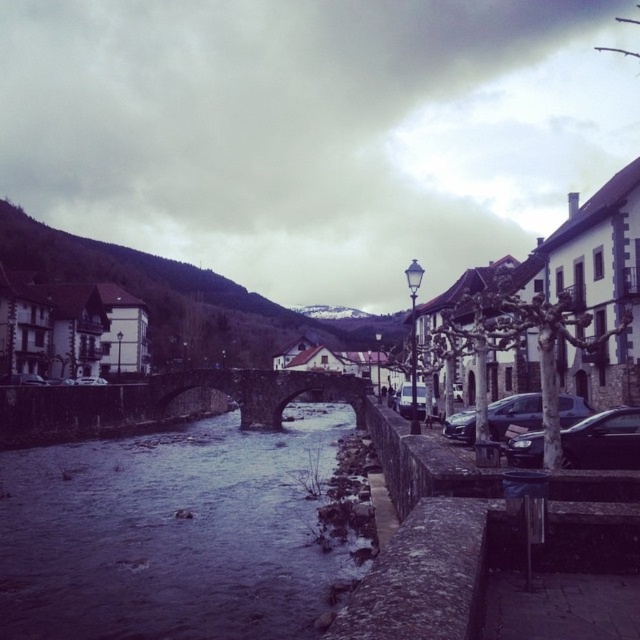
You are a tour guide leading a group along the riverside path. You want to point out both the matte white building at left and the shiny black sedan at center right to your group. If your voice can carry up to 500 feet, can you clearly address both landmarks from your current position without moving?

The matte white building at left and the shiny black sedan at center right are 464.17 feet apart. Since your voice can carry up to 500 feet, you can clearly address both landmarks from your current position without moving.

You are a tourist standing on the riverside path and want to take a photo of the matte white building at left and the shiny black sedan at center right. Based on their positions, which object should you focus on first to ensure both are in the frame?

The matte white building at left is located above the shiny black sedan at center right, so you should focus on the shiny black sedan at center right first to ensure both are in the frame.

You are standing at the riverside and want to take a photo of the dark gray stone river at center without the shiny black sedan at center right blocking the view. Which direction should you move to ensure the sedan is out of frame?

Move to the left of the dark gray stone river at center. Since the dark gray stone river at center is positioned under the shiny black sedan at center right, moving left would place the sedan out of the frame.